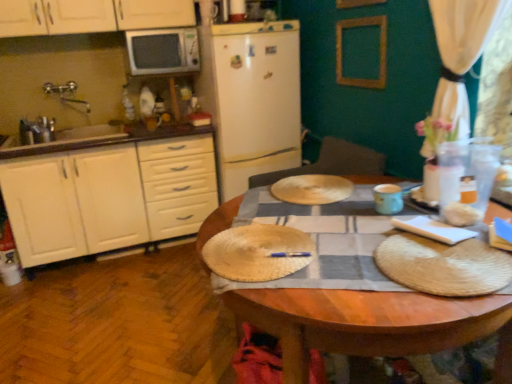
Question: From the image's perspective, would you say white matte microwave at upper left is shown under white fabric curtain at upper right?

Choices:
 (A) no
 (B) yes

Answer: (A)

Question: Would you say white matte microwave at upper left is outside white fabric curtain at upper right?

Choices:
 (A) yes
 (B) no

Answer: (A)

Question: From a real-world perspective, is white matte microwave at upper left under white fabric curtain at upper right?

Choices:
 (A) no
 (B) yes

Answer: (A)

Question: Does white matte microwave at upper left have a smaller size compared to white fabric curtain at upper right?

Choices:
 (A) yes
 (B) no

Answer: (A)

Question: Can you confirm if white matte microwave at upper left is positioned to the left of white fabric curtain at upper right?

Choices:
 (A) no
 (B) yes

Answer: (B)

Question: Considering the relative sizes of white matte microwave at upper left and white fabric curtain at upper right in the image provided, is white matte microwave at upper left taller than white fabric curtain at upper right?

Choices:
 (A) yes
 (B) no

Answer: (B)

Question: From a real-world perspective, is matte blue cup at center right physically below bamboo placemat at center?

Choices:
 (A) yes
 (B) no

Answer: (B)

Question: Is matte blue cup at center right further to camera compared to bamboo placemat at center?

Choices:
 (A) no
 (B) yes

Answer: (B)

Question: From the image's perspective, is matte blue cup at center right above bamboo placemat at center?

Choices:
 (A) yes
 (B) no

Answer: (A)

Question: From a real-world perspective, is matte blue cup at center right physically above bamboo placemat at center?

Choices:
 (A) no
 (B) yes

Answer: (B)

Question: Considering the relative sizes of matte blue cup at center right and bamboo placemat at center in the image provided, is matte blue cup at center right bigger than bamboo placemat at center?

Choices:
 (A) yes
 (B) no

Answer: (B)

Question: Is matte blue cup at center right oriented away from bamboo placemat at center?

Choices:
 (A) yes
 (B) no

Answer: (B)

Question: Is white fabric curtain at upper right surrounding bamboo placemat at center?

Choices:
 (A) no
 (B) yes

Answer: (A)